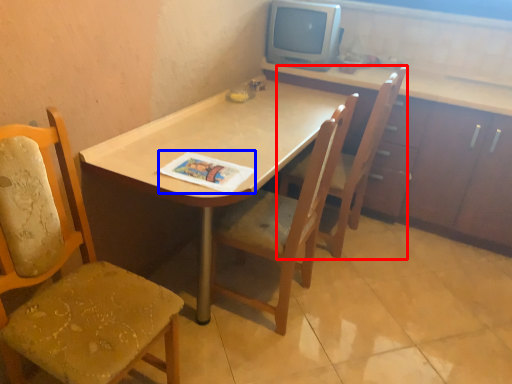
Question: Which object is closer to the camera taking this photo, chair (highlighted by a red box) or magazine (highlighted by a blue box)?

Choices:
 (A) chair
 (B) magazine

Answer: (B)